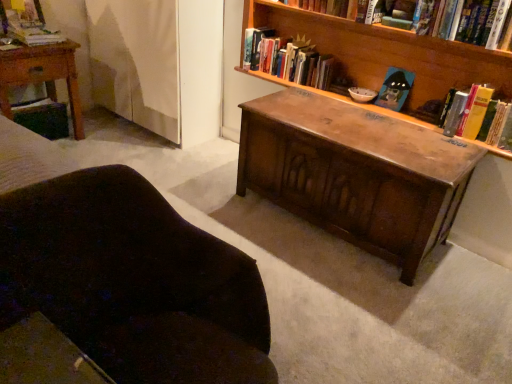
You are a GUI agent. You are given a task and a screenshot of the screen. Output one action in this format:
    pyautogui.click(x=<x>, y=<y>)
    Task: Click on the wooden bookshelf at upper center, positioned as the 5th book in right-to-left order
    Image resolution: width=512 pixels, height=384 pixels.
    Given the screenshot: What is the action you would take?
    pyautogui.click(x=290, y=59)

What do you see at coordinates (133, 281) in the screenshot?
I see `brown leather chair at lower left` at bounding box center [133, 281].

What are the coordinates of `wooden nightstand at left` in the screenshot? It's located at (x=42, y=75).

In order to face wooden nightstand at left, should I rotate leftwards or rightwards?

Turn left approximately 27.709 degrees to face it.

Image resolution: width=512 pixels, height=384 pixels. Find the location of `hardcover book at upper left, the 6th book positioned from the right`. hardcover book at upper left, the 6th book positioned from the right is located at coordinates (26, 23).

The image size is (512, 384). I want to click on yellow paperback book at right, the 6th book positioned from the left, so click(x=501, y=127).

Would you say wooden bookcase at center contains hardcover book at upper left, which ranks as the 1th book in left-to-right order?

No.

From a real-world perspective, between wooden bookcase at center and hardcover book at upper left, which ranks as the 1th book in left-to-right order, who is vertically lower?

hardcover book at upper left, which ranks as the 1th book in left-to-right order, is physically lower.

The image size is (512, 384). What are the coordinates of `the 2nd book counting from the left of the shiny brown wooden chest at center` in the screenshot? It's located at (290, 59).

Considering the sizes of objects wooden bookshelf at upper center, positioned as the 5th book in right-to-left order, and shiny brown wooden chest at center in the image provided, who is shorter, wooden bookshelf at upper center, positioned as the 5th book in right-to-left order, or shiny brown wooden chest at center?

With less height is wooden bookshelf at upper center, positioned as the 5th book in right-to-left order.

From the image's perspective, is wooden bookshelf at upper center, which is the 2th book in left-to-right order, on top of shiny brown wooden chest at center?

Yes, from the image's perspective, wooden bookshelf at upper center, which is the 2th book in left-to-right order, is above shiny brown wooden chest at center.

Would you say wooden bookshelf at upper center, which is the 2th book in left-to-right order, is inside or outside shiny brown wooden chest at center?

wooden bookshelf at upper center, which is the 2th book in left-to-right order, is outside shiny brown wooden chest at center.

In the scene shown: Is shiny brown wooden chest at center situated inside wooden bookcase at center or outside?

shiny brown wooden chest at center cannot be found inside wooden bookcase at center.

The height and width of the screenshot is (384, 512). I want to click on desk located behind the wooden bookcase at center, so click(x=355, y=173).

In the image, is shiny brown wooden chest at center positioned in front of or behind wooden bookcase at center?

Clearly, shiny brown wooden chest at center is behind wooden bookcase at center.

Does shiny brown wooden chest at center have a larger size compared to wooden bookcase at center?

Correct, shiny brown wooden chest at center is larger in size than wooden bookcase at center.

Which object is wider, wooden bookcase at center or yellow paperback book at right, the 6th book positioned from the left?

wooden bookcase at center is wider.

Does wooden bookcase at center appear on the right side of yellow paperback book at right, the first book when ordered from right to left?

In fact, wooden bookcase at center is to the left of yellow paperback book at right, the first book when ordered from right to left.

Is the depth of wooden bookcase at center less than that of yellow paperback book at right, the first book when ordered from right to left?

Yes, it is.

Considering the relative sizes of wooden bookcase at center and yellow paperback book at right, the first book when ordered from right to left, in the image provided, is wooden bookcase at center shorter than yellow paperback book at right, the first book when ordered from right to left,?

Incorrect, the height of wooden bookcase at center does not fall short of that of yellow paperback book at right, the first book when ordered from right to left.

The image size is (512, 384). Find the location of `book that is the 4th object located above the brown leather chair at lower left (from the image's perspective)`. book that is the 4th object located above the brown leather chair at lower left (from the image's perspective) is located at coordinates (290, 59).

Is wooden bookshelf at upper center, which is the 2th book in left-to-right order, aimed at brown leather chair at lower left?

Yes, wooden bookshelf at upper center, which is the 2th book in left-to-right order, is oriented towards brown leather chair at lower left.

Does wooden bookshelf at upper center, which is the 2th book in left-to-right order, come in front of brown leather chair at lower left?

No, the depth of wooden bookshelf at upper center, which is the 2th book in left-to-right order, is greater than that of brown leather chair at lower left.

Is wooden nightstand at left surrounding yellow paperback book at right, the 6th book positioned from the left?

No.

Which point is more distant from viewer, (49, 70) or (509, 134)?

The point (49, 70) is behind.

Is wooden nightstand at left directly adjacent to yellow paperback book at right, the first book when ordered from right to left?

No, wooden nightstand at left is not in contact with yellow paperback book at right, the first book when ordered from right to left.

Which is more to the left, wooden nightstand at left or yellow paperback book at right, the 6th book positioned from the left?

From the viewer's perspective, wooden nightstand at left appears more on the left side.

In the scene shown: Can you confirm if yellow paperback book at right, the 6th book positioned from the left, is smaller than hardcover book at upper right, which is the 3th book from right to left?

Yes, yellow paperback book at right, the 6th book positioned from the left, is smaller than hardcover book at upper right, which is the 3th book from right to left.

What's the angular difference between yellow paperback book at right, the first book when ordered from right to left, and hardcover book at upper right, acting as the 4th book starting from the left,'s facing directions?

0.0018 degrees.

Who is shorter, yellow paperback book at right, the first book when ordered from right to left, or hardcover book at upper right, which is the 3th book from right to left?

hardcover book at upper right, which is the 3th book from right to left, is shorter.

From a real-world perspective, is yellow paperback book at right, the first book when ordered from right to left, physically below hardcover book at upper right, which is the 3th book from right to left?

Yes, from a real-world perspective, yellow paperback book at right, the first book when ordered from right to left, is below hardcover book at upper right, which is the 3th book from right to left.

I want to click on bookcase below the hardcover book at upper left, the 6th book positioned from the right (from the image's perspective), so click(387, 51).

Where is `the 5th book behind the shiny brown wooden chest at center, counting from the anchor's position`? The image size is (512, 384). the 5th book behind the shiny brown wooden chest at center, counting from the anchor's position is located at coordinates (290, 59).

Considering their positions, is hardcover book at upper center, which ranks as the fourth book in right-to-left order, positioned closer to hardcover book at upper left, the 6th book positioned from the right, than brown leather chair at lower left?

The object closer to hardcover book at upper left, the 6th book positioned from the right, is hardcover book at upper center, which ranks as the fourth book in right-to-left order.

Estimate the real-world distances between objects in this image. Which object is closer to brown leather chair at lower left, hardcover book at upper center, which ranks as the fourth book in right-to-left order, or yellow paperback book at right, the 6th book positioned from the left?

yellow paperback book at right, the 6th book positioned from the left, is positioned closer to the anchor brown leather chair at lower left.

Estimate the real-world distances between objects in this image. Which object is further from hardcover book at upper left, which ranks as the 1th book in left-to-right order, shiny brown wooden chest at center or hardcover book at upper right, which is the 3th book from right to left?

Based on the image, hardcover book at upper right, which is the 3th book from right to left, appears to be further to hardcover book at upper left, which ranks as the 1th book in left-to-right order.

Estimate the real-world distances between objects in this image. Which object is closer to brown leather chair at lower left, yellow hardcover book at right, the 5th book positioned from the left, or hardcover book at upper left, the 6th book positioned from the right?

The object closer to brown leather chair at lower left is yellow hardcover book at right, the 5th book positioned from the left.

Considering their positions, is shiny brown wooden chest at center positioned closer to wooden nightstand at left than hardcover book at upper left, which ranks as the 1th book in left-to-right order?

Among the two, hardcover book at upper left, which ranks as the 1th book in left-to-right order, is located nearer to wooden nightstand at left.

Considering their positions, is hardcover book at upper right, acting as the 4th book starting from the left, positioned closer to hardcover book at upper left, the 6th book positioned from the right, than wooden nightstand at left?

wooden nightstand at left.

Looking at the image, which one is located closer to hardcover book at upper left, which ranks as the 1th book in left-to-right order, hardcover book at upper center, which ranks as the fourth book in right-to-left order, or wooden nightstand at left?

wooden nightstand at left.

Considering their positions, is hardcover book at upper right, acting as the 4th book starting from the left, positioned further to shiny brown wooden chest at center than yellow paperback book at right, the 6th book positioned from the left?

hardcover book at upper right, acting as the 4th book starting from the left, lies further to shiny brown wooden chest at center than the other object.

Image resolution: width=512 pixels, height=384 pixels. I want to click on bookcase between wooden bookshelf at upper center, positioned as the 5th book in right-to-left order, and yellow paperback book at right, the first book when ordered from right to left, in the horizontal direction, so click(387, 51).

Identify the location of desk between brown leather chair at lower left and hardcover book at upper right, which is the 3th book from right to left, from front to back. (355, 173).

Where is `chair between hardcover book at upper left, the 6th book positioned from the right, and yellow hardcover book at right, which is counted as the second book, starting from the right`? chair between hardcover book at upper left, the 6th book positioned from the right, and yellow hardcover book at right, which is counted as the second book, starting from the right is located at coordinates (133, 281).

This screenshot has width=512, height=384. Identify the location of bookcase located between hardcover book at upper center, which ranks as the fourth book in right-to-left order, and hardcover book at upper right, acting as the 4th book starting from the left, in the left-right direction. 387,51.